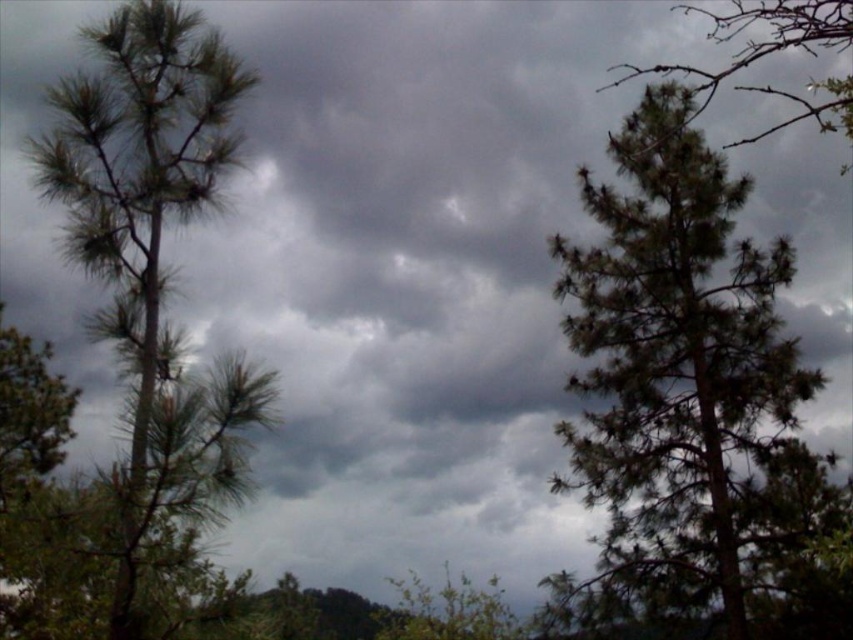
Question: Estimate the real-world distances between objects in this image. Which object is closer to the green needle-like tree at right?

Choices:
 (A) green needle-like at upper right
 (B) green needle-like at left

Answer: (A)

Question: Can you confirm if green needle-like at left is positioned to the left of green needle-like at upper right?

Choices:
 (A) yes
 (B) no

Answer: (A)

Question: Does green needle-like tree at right have a lesser width compared to green needle-like at left?

Choices:
 (A) no
 (B) yes

Answer: (A)

Question: Which object is positioned farthest from the green needle-like at upper right?

Choices:
 (A) green needle-like at left
 (B) green needle-like tree at right

Answer: (A)

Question: In this image, where is green needle-like tree at right located relative to green needle-like at left?

Choices:
 (A) below
 (B) above

Answer: (A)

Question: Which of the following is the farthest from the observer?

Choices:
 (A) (212, 51)
 (B) (844, 109)
 (C) (654, 401)

Answer: (C)